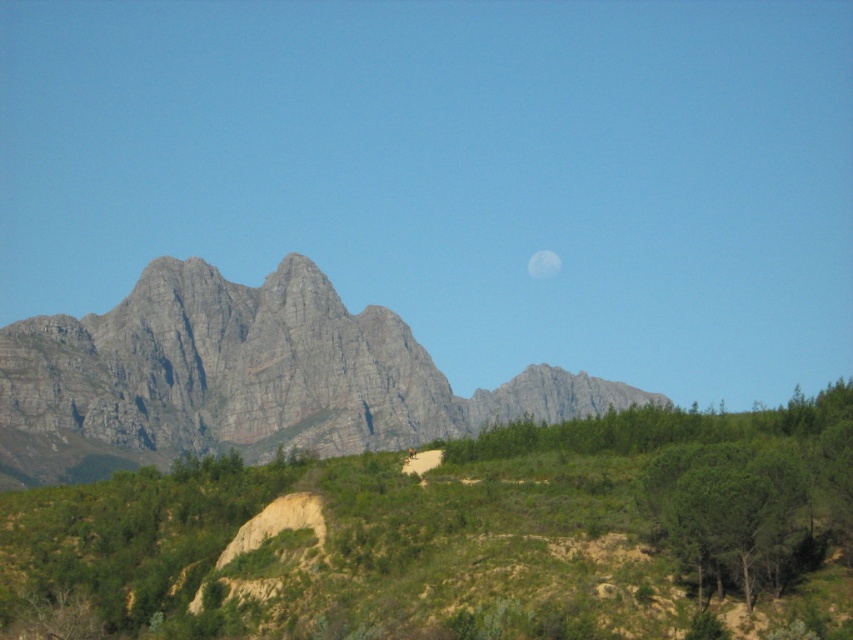
Who is positioned more to the right, gray rock mountain at upper left or white matte moon at upper center?

From the viewer's perspective, white matte moon at upper center appears more on the right side.

Image resolution: width=853 pixels, height=640 pixels. I want to click on gray rock mountain at upper left, so click(x=244, y=378).

Can you confirm if green leafy tree at lower right is positioned to the right of white matte moon at upper center?

Incorrect, green leafy tree at lower right is not on the right side of white matte moon at upper center.

From the picture: Can you confirm if green leafy tree at lower right is thinner than white matte moon at upper center?

Yes.

Locate an element on the screen. green leafy tree at lower right is located at coordinates (732, 516).

Is gray rock mountain at upper left further to camera compared to green leafy tree at lower right?

Yes, gray rock mountain at upper left is behind green leafy tree at lower right.

Which is above, gray rock mountain at upper left or green leafy tree at lower right?

gray rock mountain at upper left

The height and width of the screenshot is (640, 853). In order to click on gray rock mountain at upper left in this screenshot , I will do `click(244, 378)`.